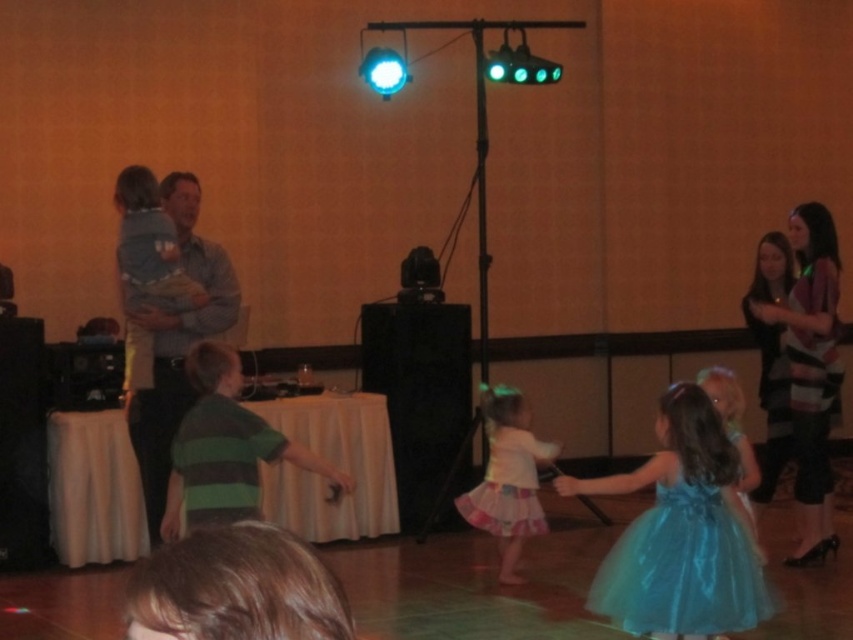
You are standing at the center of the room and want to move towards the point at coordinates (683, 566). Which direction should you go?

The point at coordinates (683, 566) is located on the shiny blue tulle dress at lower right, so you should move towards the lower right direction to reach it.

You are at the entrance of the hall and want to find the shiny blue tulle dress at lower right. Based on the coordinates provided, in which direction should you walk to locate it?

The shiny blue tulle dress at lower right is located at point (683, 566), which corresponds to the lower right area of the image. To locate it, you should walk towards the lower right direction from the entrance.